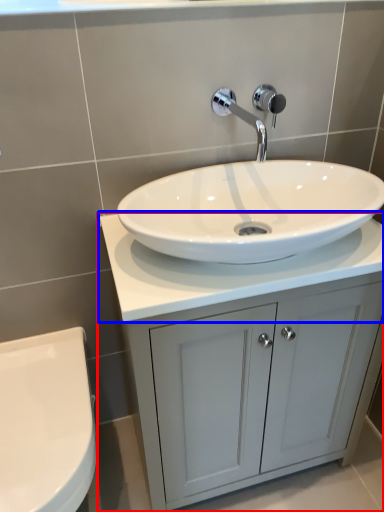
Question: Which point is further to the camera, bathroom cabinet (highlighted by a red box) or counter top (highlighted by a blue box)?

Choices:
 (A) bathroom cabinet
 (B) counter top

Answer: (A)